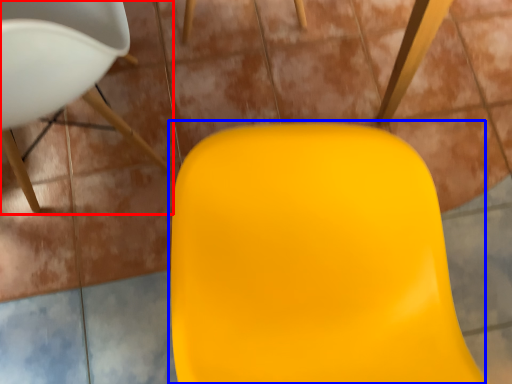
Question: Which object appears farthest to the camera in this image, chair (highlighted by a red box) or swivel chair (highlighted by a blue box)?

Choices:
 (A) chair
 (B) swivel chair

Answer: (A)